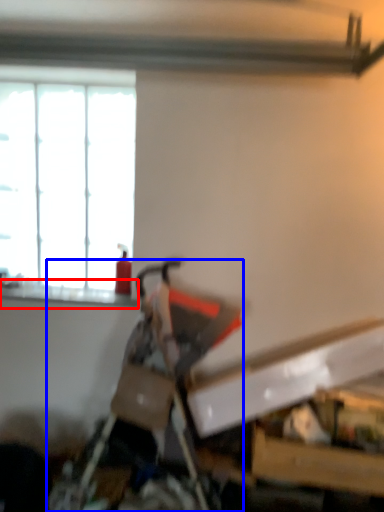
Question: Among these objects, which one is farthest to the camera, window sill (highlighted by a red box) or swivel chair (highlighted by a blue box)?

Choices:
 (A) window sill
 (B) swivel chair

Answer: (A)